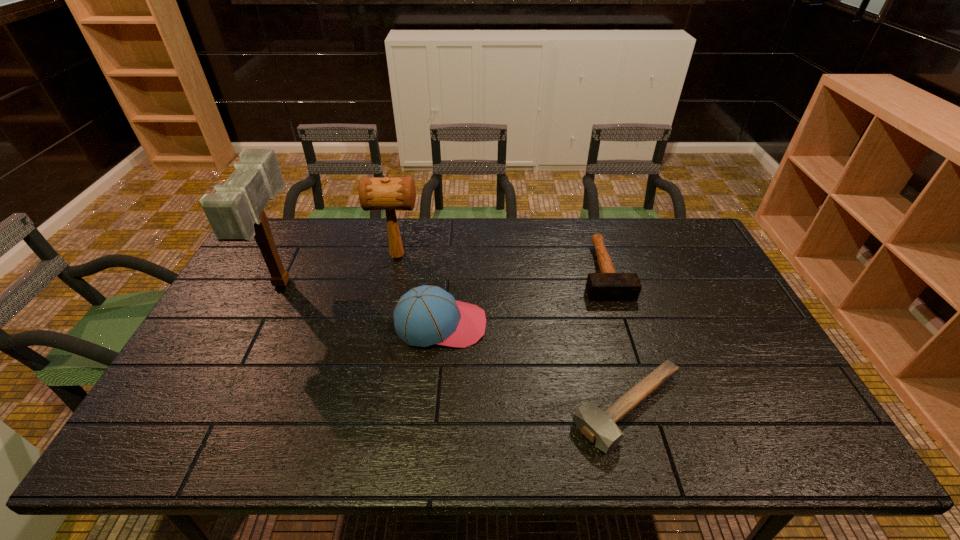
This screenshot has width=960, height=540. Identify the location of vacant area at the far right corner. (701, 256).

The image size is (960, 540). Find the location of `free space at the near right corner`. free space at the near right corner is located at coordinates (779, 437).

The width and height of the screenshot is (960, 540). In order to click on empty space that is in between the third tallest object and the nearest mallet in this screenshot , I will do `click(535, 366)`.

The height and width of the screenshot is (540, 960). I want to click on vacant space in between the shortest mallet and the second mallet from left to right, so click(513, 332).

Identify the location of empty space between the nearest mallet and the second tallest object. (513, 332).

Find the location of a particular element. This screenshot has height=540, width=960. unoccupied position between the baseball cap and the tallest mallet is located at coordinates (362, 303).

Identify the location of vacant point located between the fourth tallest object and the third shortest object. The width and height of the screenshot is (960, 540). (522, 298).

You are a GUI agent. You are given a task and a screenshot of the screen. Output one action in this format:
    pyautogui.click(x=<x>, y=<y>)
    Task: Click on the free spot between the leftmost mallet and the third shortest object
    This screenshot has height=540, width=960.
    Given the screenshot: What is the action you would take?
    pyautogui.click(x=362, y=303)

Image resolution: width=960 pixels, height=540 pixels. Find the location of `unoccupied position between the baseball cap and the leftmost object`. unoccupied position between the baseball cap and the leftmost object is located at coordinates (362, 303).

Identify the location of free space between the tallest object and the baseball cap. This screenshot has width=960, height=540. (362, 303).